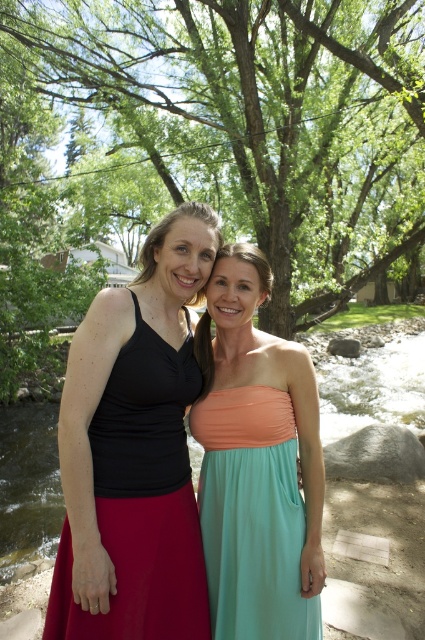
Question: Does matte black dress at left have a smaller size compared to green fabric dress at center?

Choices:
 (A) no
 (B) yes

Answer: (B)

Question: Is teal satin strapless dress at center to the right of green fabric dress at center from the viewer's perspective?

Choices:
 (A) yes
 (B) no

Answer: (B)

Question: Considering the real-world distances, which object is farthest from the green fabric dress at center?

Choices:
 (A) matte black dress at left
 (B) teal satin strapless dress at center

Answer: (A)

Question: Can you confirm if teal satin strapless dress at center is positioned to the right of green fabric dress at center?

Choices:
 (A) no
 (B) yes

Answer: (A)

Question: Which object is the closest to the matte black dress at left?

Choices:
 (A) green fabric dress at center
 (B) teal satin strapless dress at center

Answer: (B)

Question: Which point appears closest to the camera in this image?

Choices:
 (A) (39, 412)
 (B) (271, 493)
 (C) (133, 307)

Answer: (C)